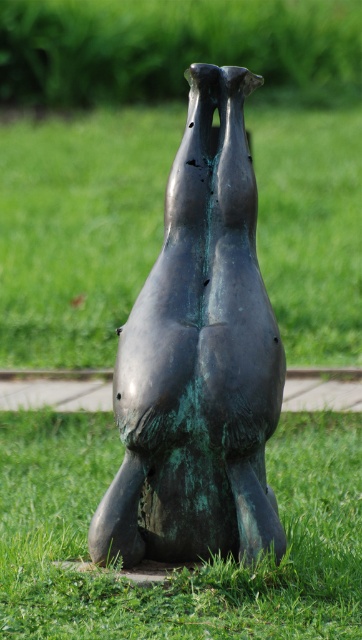
Question: From the image, what is the correct spatial relationship of green patina bronze sculpture at center in relation to green verdigris statue at center?

Choices:
 (A) above
 (B) below

Answer: (A)

Question: Does green patina bronze sculpture at center lie behind green verdigris statue at center?

Choices:
 (A) no
 (B) yes

Answer: (B)

Question: Among these points, which one is nearest to the camera?

Choices:
 (A) (26, 420)
 (B) (233, 74)

Answer: (B)

Question: Does green patina bronze sculpture at center have a larger size compared to green verdigris statue at center?

Choices:
 (A) yes
 (B) no

Answer: (B)

Question: Which point appears closest to the camera in this image?

Choices:
 (A) (131, 348)
 (B) (271, 577)

Answer: (B)

Question: Which point is closer to the camera taking this photo?

Choices:
 (A) (204, 513)
 (B) (295, 564)

Answer: (B)